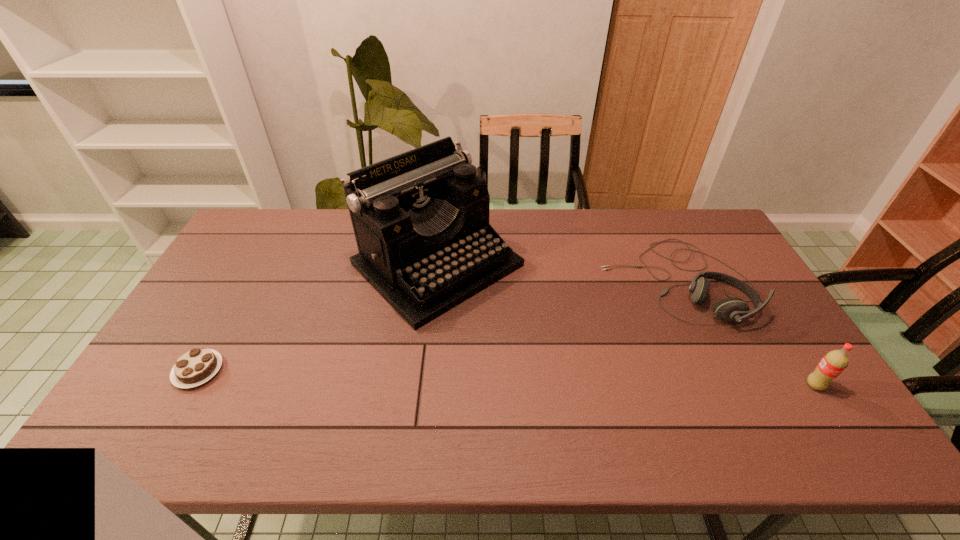
Identify the location of vacant spot on the desktop that is between the leftmost object and the second tallest object and is positioned on the outer surface of the headset. Image resolution: width=960 pixels, height=540 pixels. (529, 379).

Where is `free spot on the desktop that is between the chocolate cake and the soda and is positioned on the typing side of the typewriter`? Image resolution: width=960 pixels, height=540 pixels. free spot on the desktop that is between the chocolate cake and the soda and is positioned on the typing side of the typewriter is located at coordinates (572, 380).